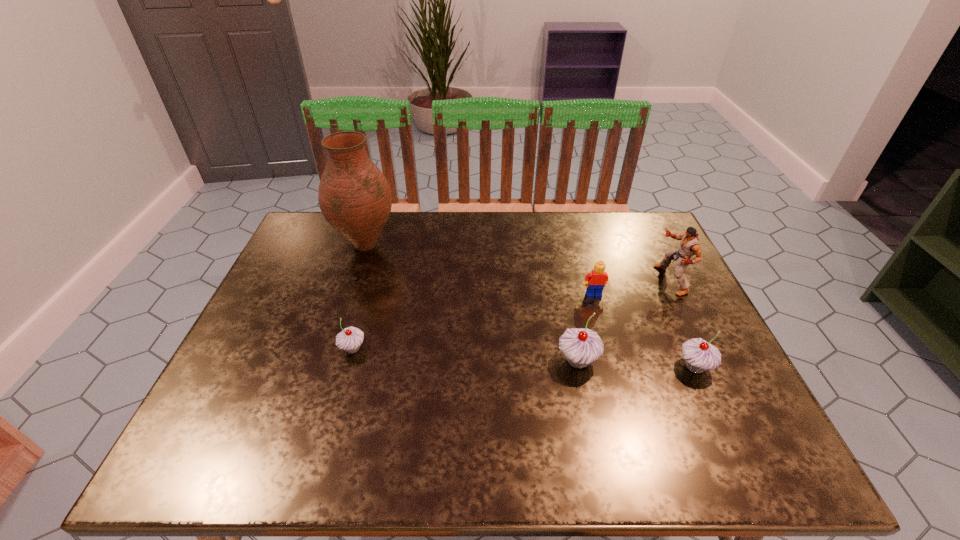
The height and width of the screenshot is (540, 960). In the image, there is a desktop. In order to click on vacant space at the far edge in this screenshot , I will do `click(553, 217)`.

Where is `free space at the near edge`? Image resolution: width=960 pixels, height=540 pixels. free space at the near edge is located at coordinates (352, 403).

Identify the location of vacant space at the left edge of the desktop. (283, 294).

In the image, there is a desktop. Identify the location of vacant area at the right edge. (631, 257).

Where is `free space at the far left corner of the desktop`? Image resolution: width=960 pixels, height=540 pixels. free space at the far left corner of the desktop is located at coordinates (303, 225).

The width and height of the screenshot is (960, 540). Identify the location of vacant point at the far right corner. (626, 237).

Where is `free space at the near right corner of the desktop`? Image resolution: width=960 pixels, height=540 pixels. free space at the near right corner of the desktop is located at coordinates (743, 400).

Identify the location of vacant area between the second cupcake from right to left and the second tallest cupcake. This screenshot has width=960, height=540. (636, 363).

Locate an element on the screen. Image resolution: width=960 pixels, height=540 pixels. free space that is in between the Lego and the second shortest cupcake is located at coordinates (644, 330).

This screenshot has width=960, height=540. Identify the location of unoccupied position between the rightmost cupcake and the Lego. (644, 330).